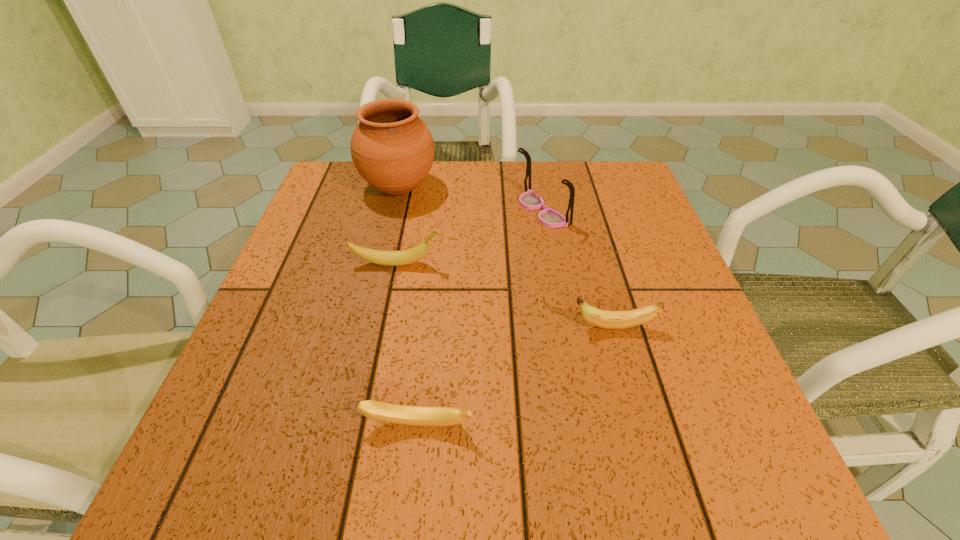
I want to click on the tallest object, so click(392, 149).

Identify the location of the fourth shortest object. (548, 217).

Where is `the third farthest object`? the third farthest object is located at coordinates (402, 257).

At what (x,y) coordinates should I click in order to perform the action: click on the fourth farthest object. Please return your answer as a coordinate pair (x, y). The width and height of the screenshot is (960, 540). Looking at the image, I should click on (604, 319).

Identify the location of the fourth tallest object. This screenshot has width=960, height=540. (604, 319).

Find the location of a particular element. the nearest object is located at coordinates (400, 414).

Image resolution: width=960 pixels, height=540 pixels. I want to click on the shortest object, so click(x=400, y=414).

This screenshot has width=960, height=540. Identify the location of vacant space located on the front of the pottery. (369, 310).

Identify the location of vacant space positioned on the left of the second tallest object. This screenshot has height=540, width=960. (425, 211).

Locate an element on the screen. This screenshot has height=540, width=960. vacant space located 0.370m at the stem of the farthest banana is located at coordinates (630, 264).